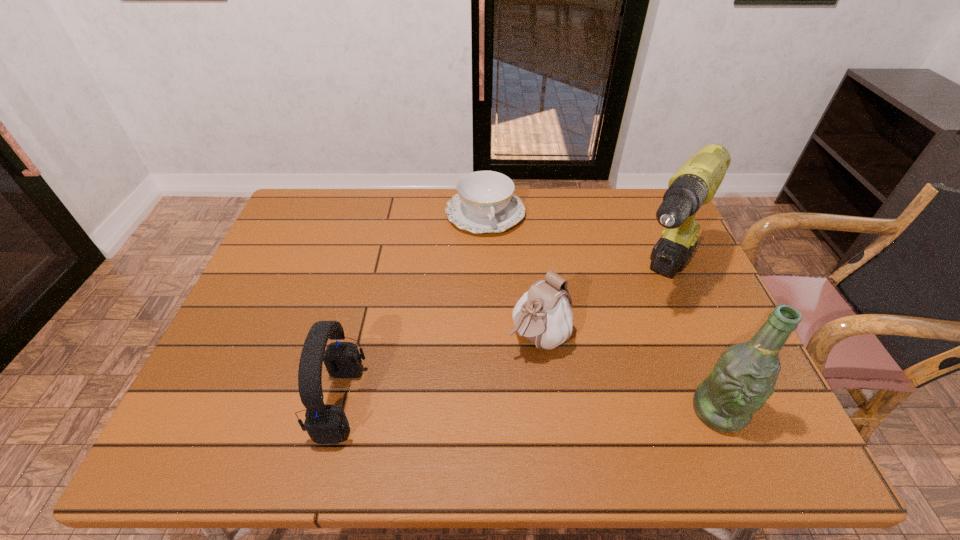
You are a GUI agent. You are given a task and a screenshot of the screen. Output one action in this format:
    pyautogui.click(x=<x>, y=<y>)
    Task: Click on the free spot on the desktop that is between the headset and the beer bottle and is positioned on the front-facing side of the pouch
    
    Given the screenshot: What is the action you would take?
    pyautogui.click(x=473, y=405)

Where is `free space on the desktop that is between the leftmost object and the beer bottle and is positioned on the handle side of the chinaware`? This screenshot has width=960, height=540. free space on the desktop that is between the leftmost object and the beer bottle and is positioned on the handle side of the chinaware is located at coordinates (546, 407).

Find the location of a particular element. vacant spot on the desktop that is between the leftmost object and the beer bottle and is positioned on the handle side of the drill is located at coordinates (574, 407).